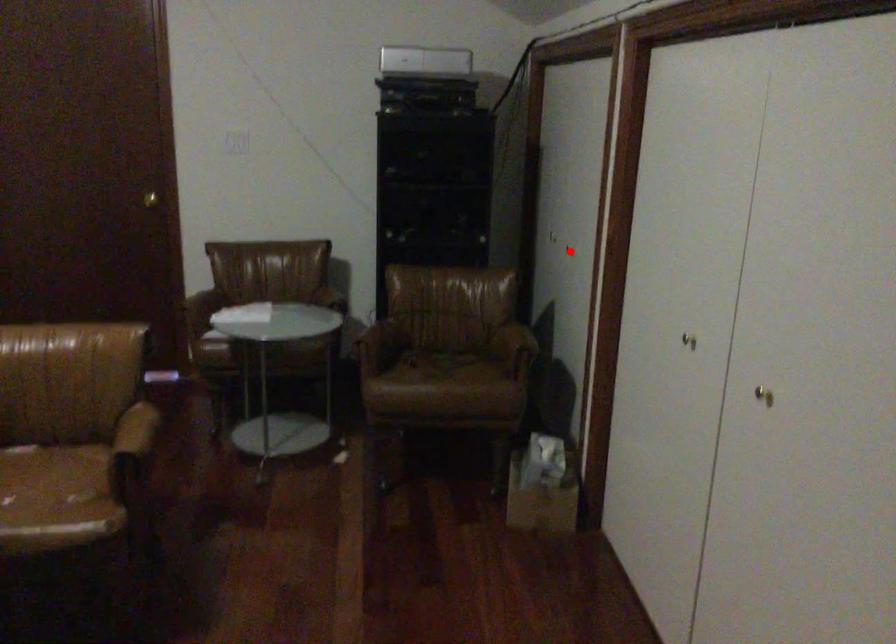
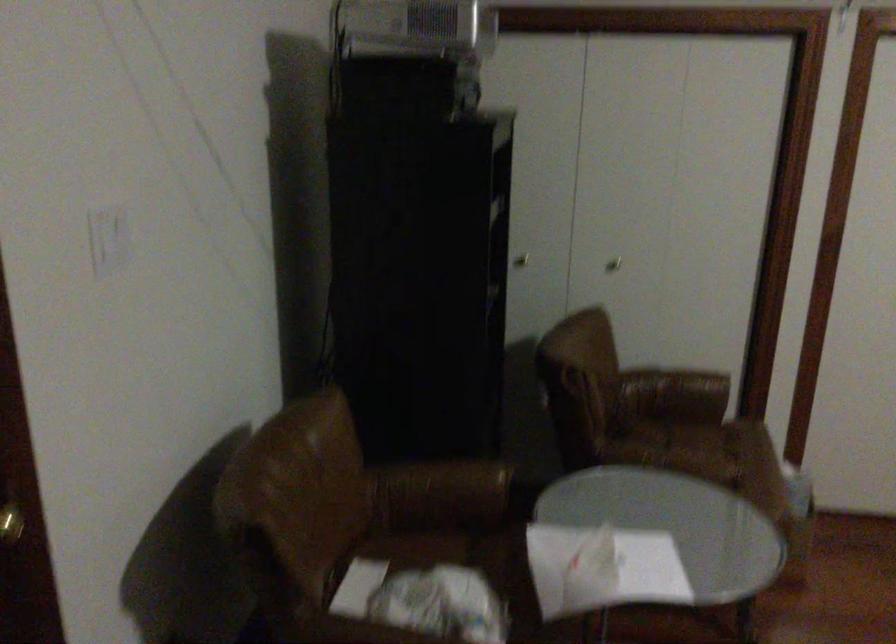
The point at the highlighted location is marked in the first image. Where is the corresponding point in the second image?

(613, 263)